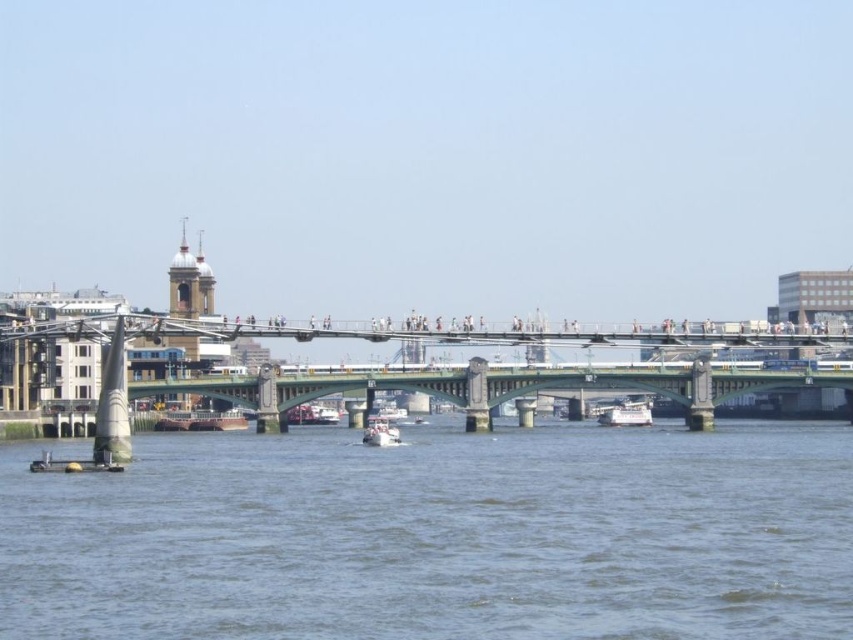
Question: Can you confirm if clear water at lower center is bigger than brown wooden boat at center?

Choices:
 (A) no
 (B) yes

Answer: (B)

Question: Does brown wooden boat at center have a larger size compared to white glossy boat at center?

Choices:
 (A) yes
 (B) no

Answer: (B)

Question: Which object is closer to the camera taking this photo?

Choices:
 (A) clear water at lower center
 (B) brown wooden boat at center

Answer: (A)

Question: Which object appears farthest from the camera in this image?

Choices:
 (A) white glossy boat at center
 (B) metallic gray boat at lower left

Answer: (A)

Question: Is clear water at lower center in front of brown wooden boat at center?

Choices:
 (A) no
 (B) yes

Answer: (B)

Question: Which object is farther from the camera taking this photo?

Choices:
 (A) clear water at lower center
 (B) brown wooden boat at center

Answer: (B)